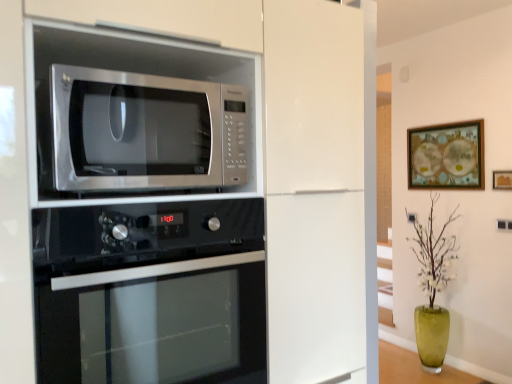
Question: Is point (506, 170) closer or farther from the camera than point (140, 94)?

Choices:
 (A) closer
 (B) farther

Answer: (B)

Question: In the image, is wooden framed picture at upper right, positioned as the 1th picture frame in front-to-back order, positioned in front of or behind satin white oven at upper left?

Choices:
 (A) behind
 (B) front

Answer: (A)

Question: Which object is positioned farthest from the stainless steel microwave at upper left?

Choices:
 (A) wooden framed artwork at upper right, which is the first picture frame from back to front
 (B) black glass oven at lower center
 (C) satin white oven at upper left
 (D) wooden framed picture at upper right, the 2th picture frame positioned from the back
 (E) green glass vase at lower right

Answer: (E)

Question: Estimate the real-world distances between objects in this image. Which object is closer to the black glass oven at lower center?

Choices:
 (A) green glass vase at lower right
 (B) stainless steel microwave at upper left
 (C) satin white oven at upper left
 (D) wooden framed picture at upper right, the 2th picture frame positioned from the back
 (E) wooden framed artwork at upper right, which is counted as the second picture frame, starting from the front

Answer: (C)